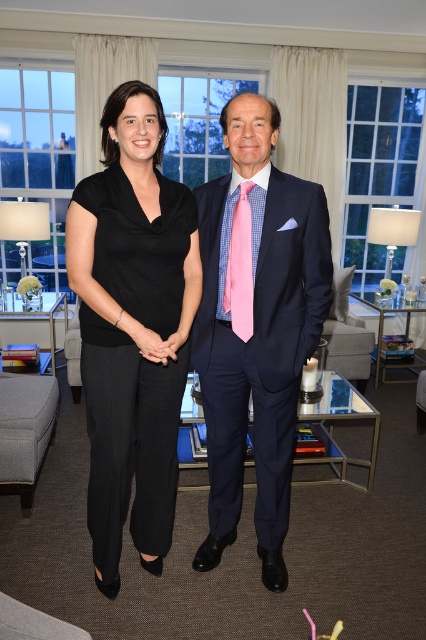
Is point (66, 234) positioned in front of point (129, 324)?

No, it is not.

How distant is matte black dress at center from matte black hands at center?

A distance of 18.61 inches exists between matte black dress at center and matte black hands at center.

Does point (328, 308) come closer to viewer compared to point (149, 330)?

No, (328, 308) is behind (149, 330).

Where is `matte black dress at center`? Image resolution: width=426 pixels, height=640 pixels. matte black dress at center is located at coordinates (258, 330).

Who is positioned more to the left, matte black dress at center or pink checkered tie at center?

pink checkered tie at center

Who is taller, matte black dress at center or pink checkered tie at center?

matte black dress at center

At what (x,y) coordinates should I click in order to perform the action: click on matte black dress at center. Please return your answer as a coordinate pair (x, y). Looking at the image, I should click on (258, 330).

Between black smooth dress at center and matte black hands at center, which one has less height?

With less height is matte black hands at center.

Does black smooth dress at center have a lesser height compared to matte black hands at center?

In fact, black smooth dress at center may be taller than matte black hands at center.

Describe the element at coordinates (129, 440) in the screenshot. The image size is (426, 640). I see `black smooth dress at center` at that location.

This screenshot has width=426, height=640. In order to click on black smooth dress at center in this screenshot , I will do `click(129, 440)`.